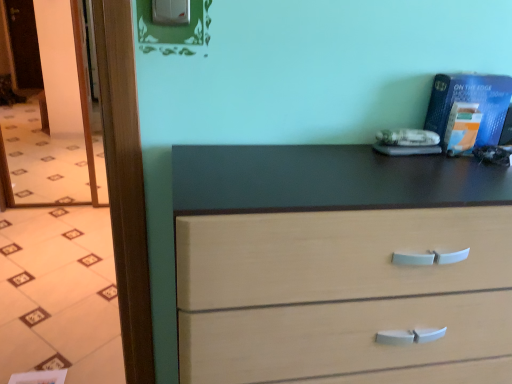
Question: Would you say light wood chest of drawers at center is to the left or to the right of transparent glass door at left in the picture?

Choices:
 (A) left
 (B) right

Answer: (B)

Question: Is light wood chest of drawers at center wider or thinner than transparent glass door at left?

Choices:
 (A) thin
 (B) wide

Answer: (B)

Question: Is point (410, 349) closer or farther from the camera than point (59, 16)?

Choices:
 (A) closer
 (B) farther

Answer: (A)

Question: Is point (50, 87) closer or farther from the camera than point (268, 380)?

Choices:
 (A) farther
 (B) closer

Answer: (A)

Question: Considering the positions of transparent glass door at left and light wood chest of drawers at center in the image, is transparent glass door at left bigger or smaller than light wood chest of drawers at center?

Choices:
 (A) big
 (B) small

Answer: (B)

Question: Is transparent glass door at left in front of or behind light wood chest of drawers at center in the image?

Choices:
 (A) behind
 (B) front

Answer: (A)

Question: In terms of height, does transparent glass door at left look taller or shorter compared to light wood chest of drawers at center?

Choices:
 (A) tall
 (B) short

Answer: (A)